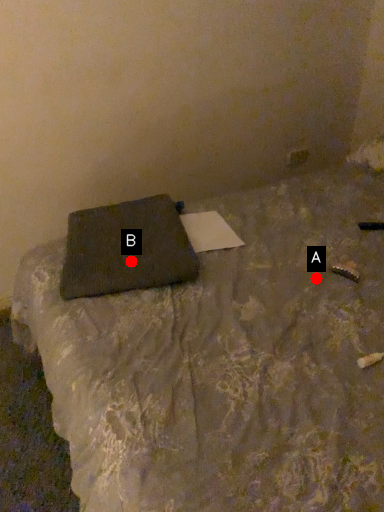
Question: Two points are circled on the image, labeled by A and B beside each circle. Which of the following is the farthest from the observer?

Choices:
 (A) A is further
 (B) B is further

Answer: (A)